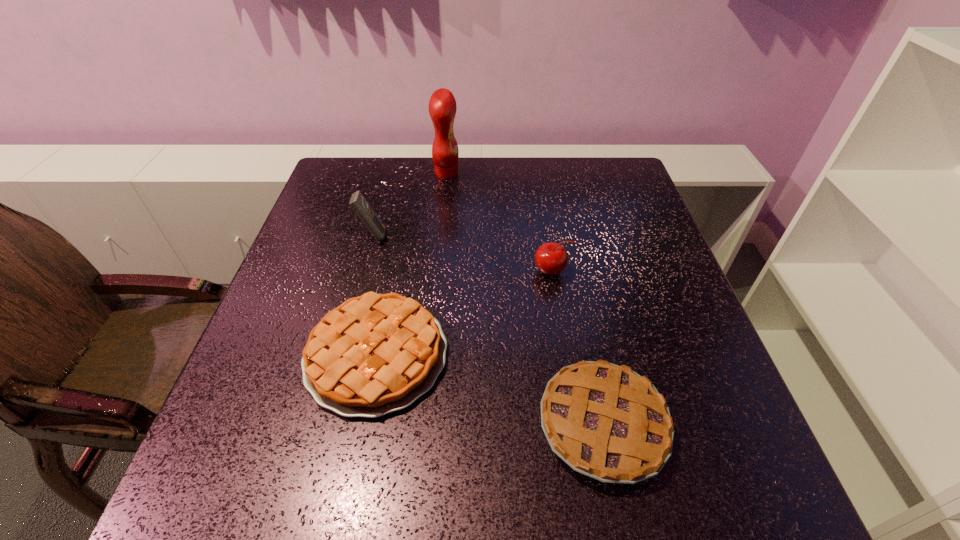
The width and height of the screenshot is (960, 540). In order to click on free space that satisfies the following two spatial constraints: 1. on the front-facing side of the calculator; 2. on the left side of the left pie in this screenshot , I will do `click(341, 355)`.

Identify the location of vacant region that satisfies the following two spatial constraints: 1. on the front-facing side of the calculator; 2. on the back side of the right pie. The image size is (960, 540). (322, 425).